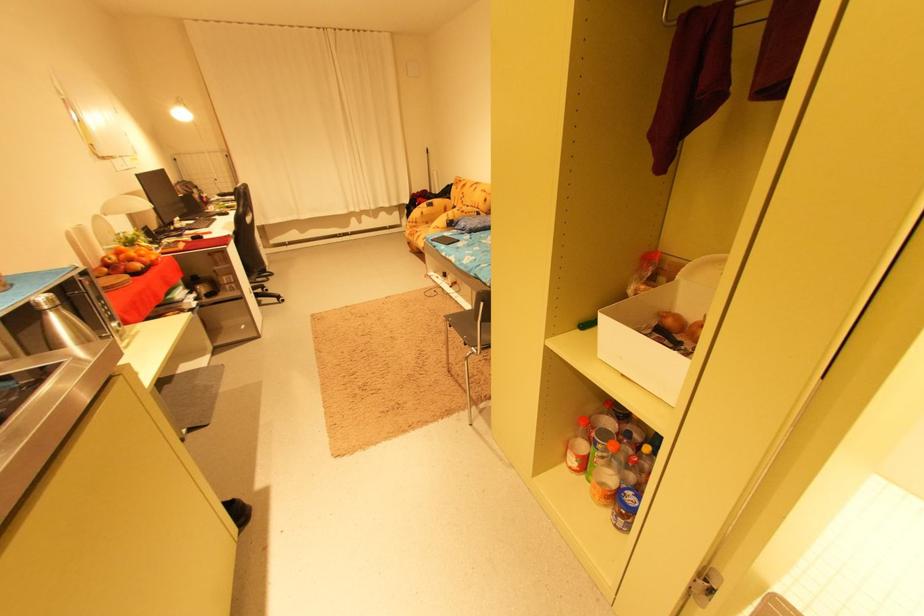
Where is `black chair seat`? The height and width of the screenshot is (616, 924). black chair seat is located at coordinates (469, 328).